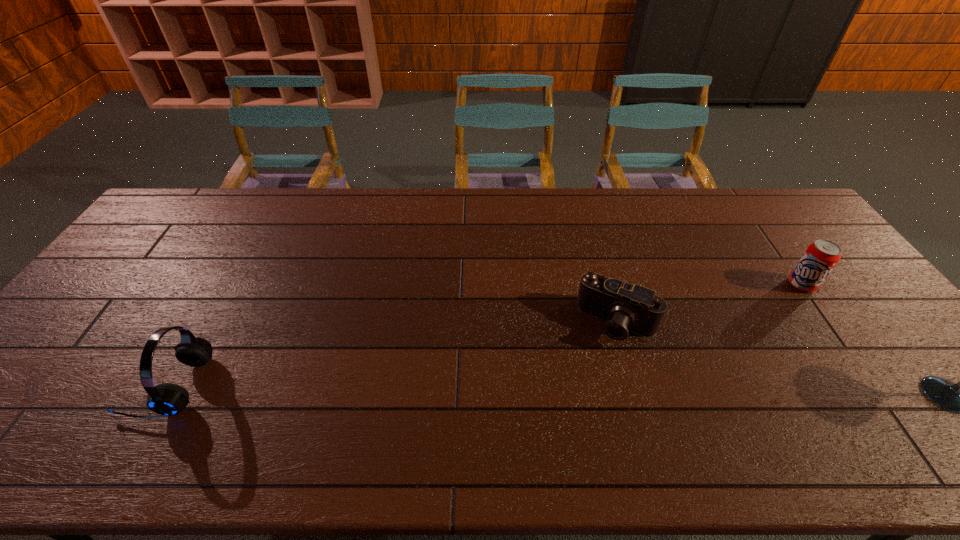
At what (x,y) coordinates should I click in order to perform the action: click on vacant space on the desktop that is between the leftmost object and the martini and is positioned on the front-facing side of the third object from right to left. Please return your answer as a coordinate pair (x, y). The width and height of the screenshot is (960, 540). Looking at the image, I should click on (584, 390).

The image size is (960, 540). Find the location of `free spot on the desktop that is between the leftmost object and the rightmost object and is positioned on the surface of the third object from left to right`. free spot on the desktop that is between the leftmost object and the rightmost object and is positioned on the surface of the third object from left to right is located at coordinates (647, 392).